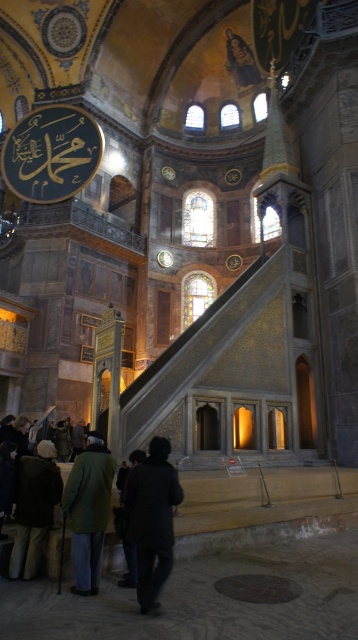
Question: Does dark gray coat at lower center appear on the right side of dark green jacket at lower left?

Choices:
 (A) yes
 (B) no

Answer: (A)

Question: Which object is closer to the camera taking this photo?

Choices:
 (A) dark gray coat at lower center
 (B) dark green jacket at lower left
 (C) dark green coat at lower left

Answer: (A)

Question: Which object is the closest to the dark green jacket at lower left?

Choices:
 (A) dark gray coat at lower center
 (B) dark green coat at lower left

Answer: (B)

Question: Is dark green coat at lower left wider than dark green jacket at lower left?

Choices:
 (A) yes
 (B) no

Answer: (A)

Question: Can you confirm if dark gray coat at lower center is wider than dark green jacket at lower left?

Choices:
 (A) no
 (B) yes

Answer: (B)

Question: Which point is closer to the camera?

Choices:
 (A) dark gray coat at lower center
 (B) dark green coat at lower left

Answer: (A)